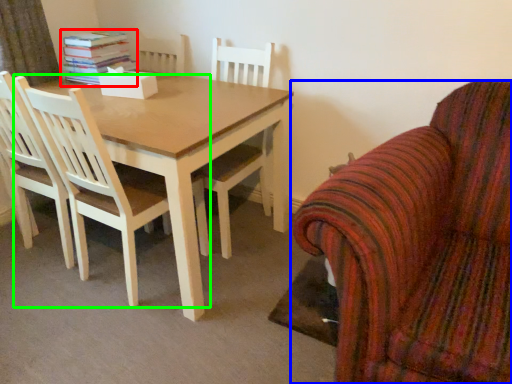
Question: Which object is positioned farthest from book (highlighted by a red box)? Select from chair (highlighted by a blue box) and chair (highlighted by a green box).

Choices:
 (A) chair
 (B) chair

Answer: (A)